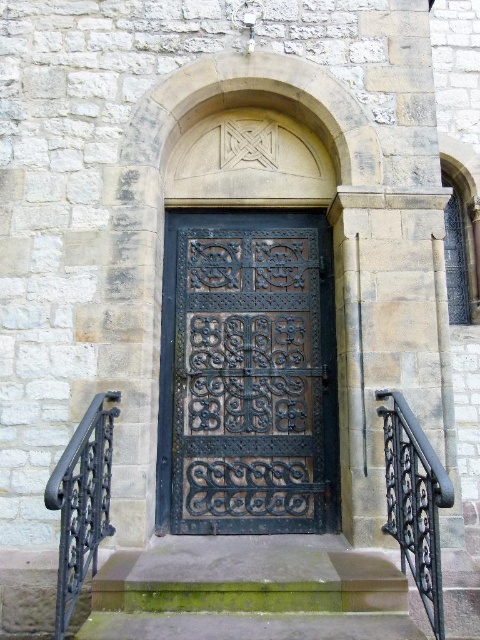
You are a delivery person with a box that is 1.2 meters wide. You need to carry it through the entrance shown in the image. Can you fit the box between the dark brown wrought iron door at center and the black wrought iron railing at left?

The dark brown wrought iron door at center is 1.14 meters away from the black wrought iron railing at left. Since the box is 1.2 meters wide, it is slightly wider than the gap between the door and the railing. Therefore, the box cannot fit through that space.

You are a delivery person with a box that is 4 feet wide. You need to move the box through the space between the dark brown wrought iron door at center and the black wrought iron railing at right. Can the box fit through that space?

The dark brown wrought iron door at center and the black wrought iron railing at right are 3.74 feet apart from each other. Since the box is 4 feet wide, it cannot fit through the space between them.